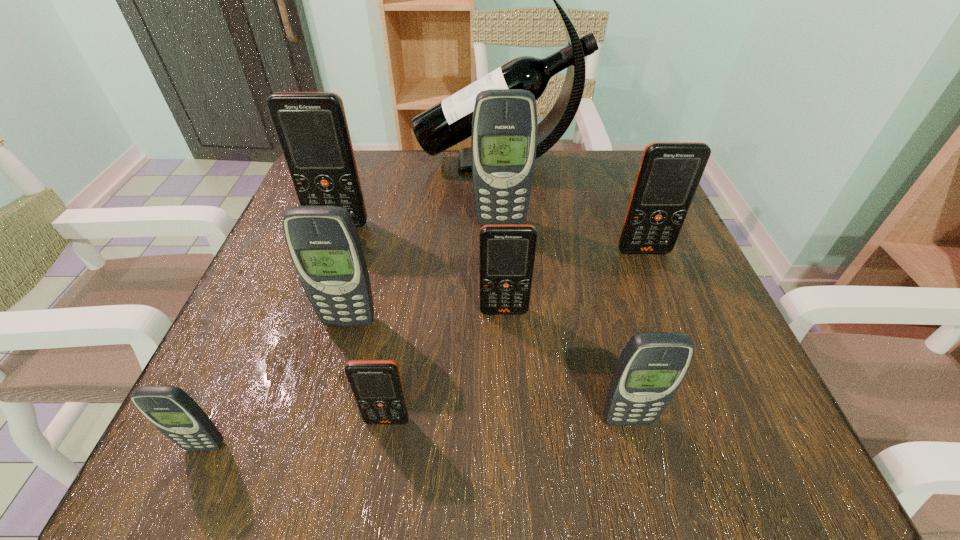
Identify the location of empty space between the farthest orange cellular telephone and the farthest gray cellular telephone. The image size is (960, 540). (420, 224).

What are the coordinates of `empty space that is in between the third farthest gray cellular telephone and the leftmost orange cellular telephone` in the screenshot? It's located at (483, 322).

At what (x,y) coordinates should I click in order to perform the action: click on vacant space that's between the rightmost cellular telephone and the second nearest orange cellular telephone. Please return your answer as a coordinate pair (x, y). This screenshot has height=540, width=960. Looking at the image, I should click on (574, 281).

The height and width of the screenshot is (540, 960). In order to click on free space between the rightmost object and the nearest object in this screenshot , I will do `click(424, 348)`.

At what (x,y) coordinates should I click in order to perform the action: click on unoccupied position between the second biggest gray cellular telephone and the third gray cellular telephone from left to right. Please return your answer as a coordinate pair (x, y). The width and height of the screenshot is (960, 540). Looking at the image, I should click on (425, 272).

Image resolution: width=960 pixels, height=540 pixels. Identify the location of object identified as the third closest to the second orange cellular telephone from left to right. (507, 252).

Where is `object that is the fourth closest one to the rightmost cellular telephone`? The image size is (960, 540). object that is the fourth closest one to the rightmost cellular telephone is located at coordinates (652, 366).

At what (x,y) coordinates should I click in order to perform the action: click on cellular telephone that is the closest to the farthest gray cellular telephone. Please return your answer as a coordinate pair (x, y). This screenshot has width=960, height=540. Looking at the image, I should click on (669, 174).

Locate which cellular telephone ranks fifth in proximity to the third smallest gray cellular telephone. Please provide its 2D coordinates. Your answer should be formatted as a tuple, i.e. [(x, y)], where the tuple contains the x and y coordinates of a point satisfying the conditions above.

[(504, 127)]

Choose which orange cellular telephone is the third nearest neighbor to the farthest orange cellular telephone. Please provide its 2D coordinates. Your answer should be formatted as a tuple, i.e. [(x, y)], where the tuple contains the x and y coordinates of a point satisfying the conditions above.

[(669, 174)]